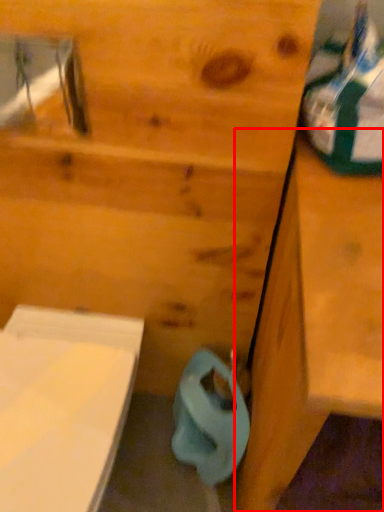
Question: From the image's perspective, considering the relative positions of vanity (annotated by the red box) and toilet paper in the image provided, where is vanity (annotated by the red box) located with respect to the staircase?

Choices:
 (A) below
 (B) above

Answer: (B)